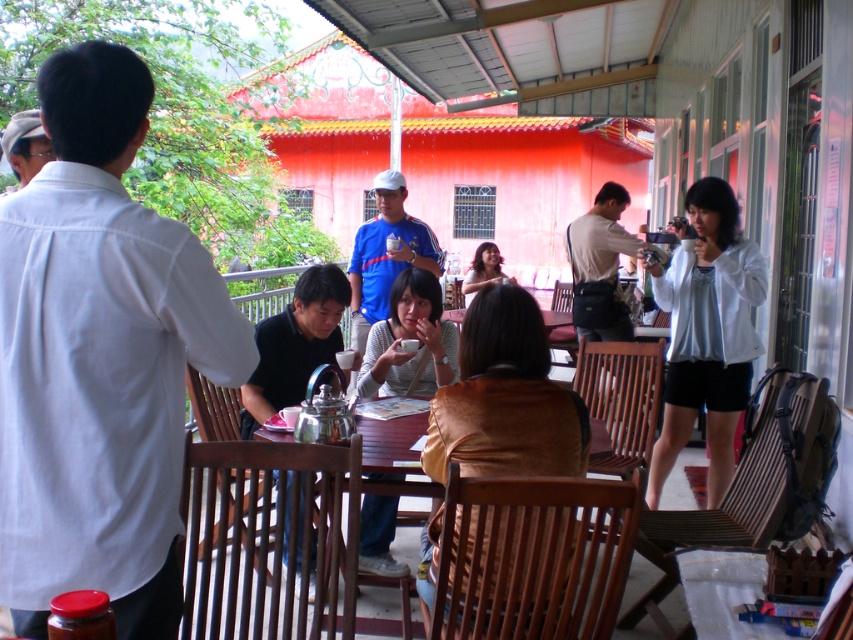
From the picture: Does white cotton shirt at left appear under black matte shirt at center?

No, white cotton shirt at left is not below black matte shirt at center.

Which is in front, point (54, 506) or point (241, 417)?

Point (54, 506)

The image size is (853, 640). In order to click on white cotton shirt at left in this screenshot , I will do `click(99, 358)`.

Is point (136, 531) positioned behind point (701, 301)?

No, (136, 531) is in front of (701, 301).

Does white cotton shirt at left have a lesser height compared to white matte jacket at right?

Yes.

Is point (193, 259) positioned in front of point (671, 278)?

Yes, it is in front of point (671, 278).

This screenshot has height=640, width=853. Find the location of `white cotton shirt at left`. white cotton shirt at left is located at coordinates (99, 358).

Who is more forward, (129, 252) or (415, 273)?

Point (129, 252) is in front.

Can you confirm if white cotton shirt at left is positioned below matte brown sweater at center?

Correct, white cotton shirt at left is located below matte brown sweater at center.

Which is in front, point (53, 60) or point (412, 282)?

Positioned in front is point (53, 60).

Identify the location of white cotton shirt at left. The height and width of the screenshot is (640, 853). (99, 358).